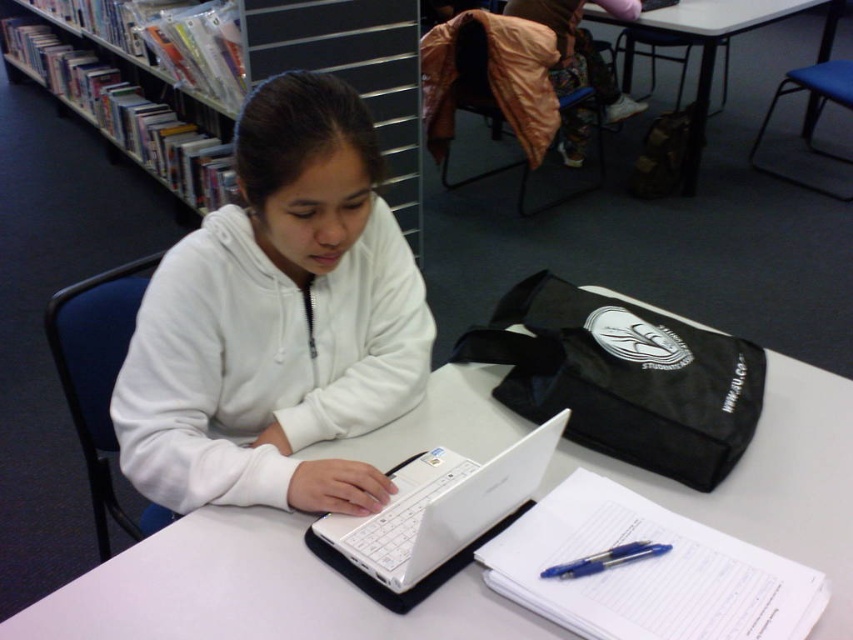
Can you confirm if white plastic table at center is bigger than white plastic bookshelf at upper left?

No.

Can you confirm if white plastic table at center is thinner than white plastic bookshelf at upper left?

Indeed, white plastic table at center has a lesser width compared to white plastic bookshelf at upper left.

This screenshot has width=853, height=640. I want to click on white plastic table at center, so tap(251, 593).

Is white plastic laptop at center bigger than blue glossy pen at lower center?

Indeed, white plastic laptop at center has a larger size compared to blue glossy pen at lower center.

Measure the distance between white plastic laptop at center and camera.

The distance of white plastic laptop at center from camera is 74.55 centimeters.

Is point (409, 550) more distant than point (585, 576)?

Yes, point (409, 550) is farther from viewer.

Find the location of a particular element. white plastic laptop at center is located at coordinates (439, 508).

Consider the image. Which of these two, white plastic bookshelf at upper left or blue glossy pen at lower center, stands taller?

With more height is white plastic bookshelf at upper left.

Does point (405, 163) lie behind point (660, 545)?

Yes.

You are a GUI agent. You are given a task and a screenshot of the screen. Output one action in this format:
    pyautogui.click(x=<x>, y=<y>)
    Task: Click on the white plastic bookshelf at upper left
    
    Given the screenshot: What is the action you would take?
    pyautogui.click(x=352, y=74)